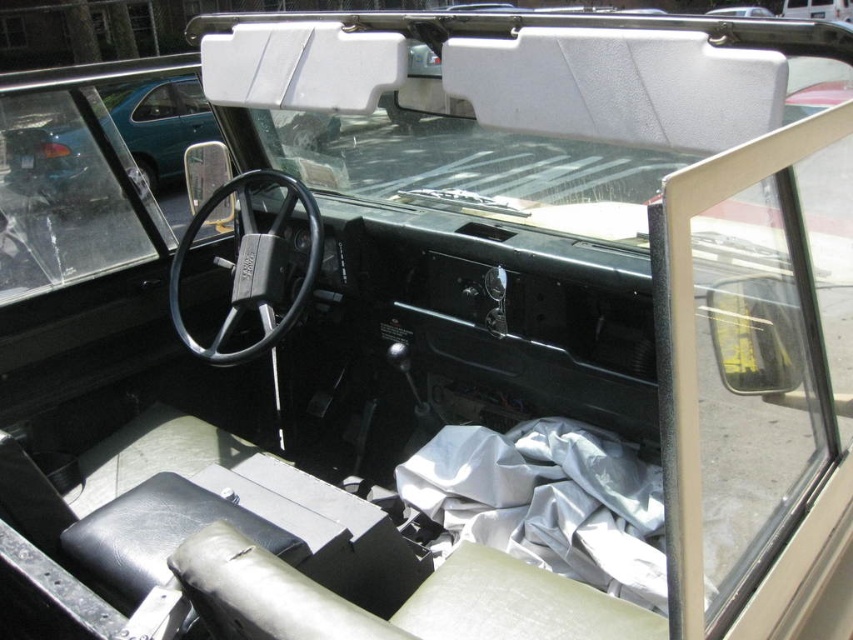
In the scene shown: Which is below, white matte windshield at center or white fabric at center?

white fabric at center

Which is above, white matte windshield at center or white fabric at center?

white matte windshield at center is above.

Between point (465, 83) and point (498, 461), which one is positioned in front?

Point (465, 83) is more forward.

I want to click on white matte windshield at center, so click(520, 100).